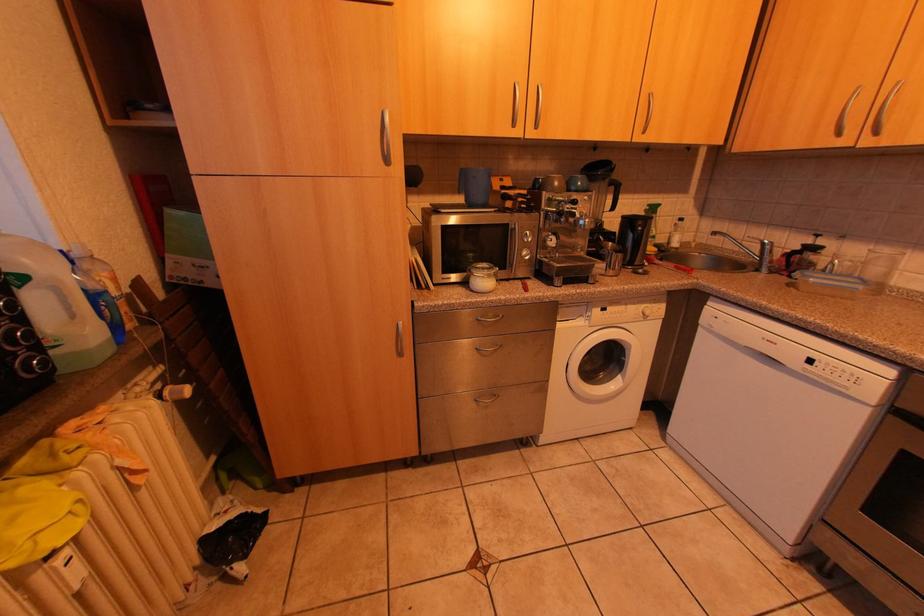
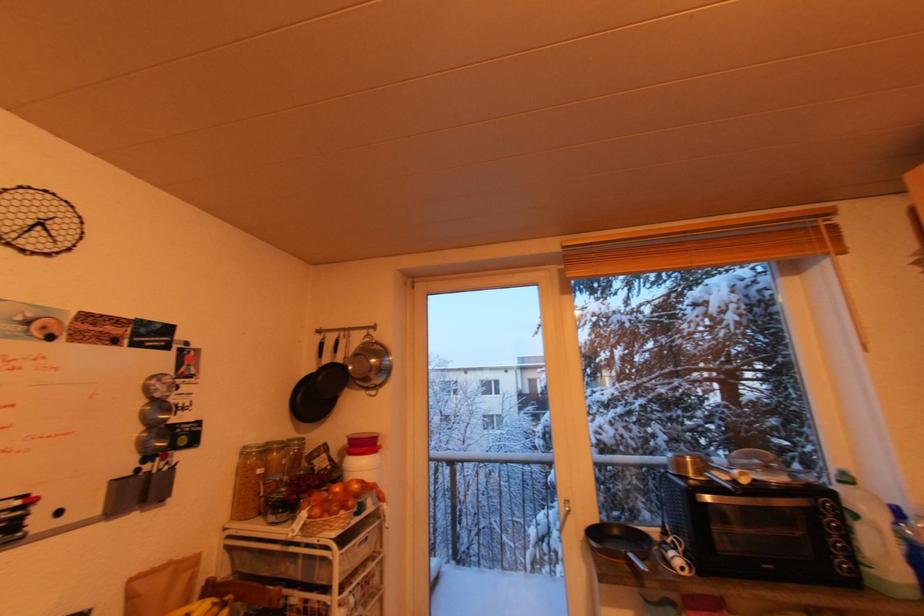
Question: The camera is either moving clockwise (left) or counter-clockwise (right) around the object. The first image is from the beginning of the video and the second image is from the end. Is the camera moving left or right when shooting the video?

Choices:
 (A) Left
 (B) Right

Answer: (B)